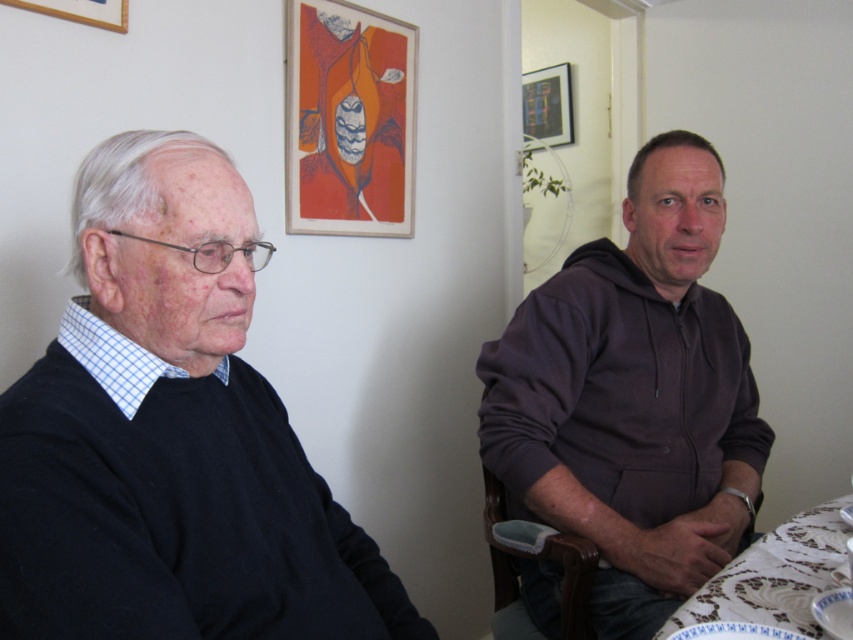
You are a delivery person trying to place a small package on the table near the white lace tablecloth at lower right. The package needs to be placed exactly 1.2 meters away from the wooden picture frame at upper left. Can you place it on that table?

The white lace tablecloth at lower right is 1.35 meters from the wooden picture frame at upper left. Since the required distance is 1.2 meters, placing the package on the table with the white lace tablecloth at lower right would be slightly farther than needed. You might need to find another location closer to the wooden picture frame at upper left.

You are a painter who needs to hang a new painting that is 3 feet wide. You are standing in the room and see the white lace tablecloth at lower right and the wooden picture frame at upper center. Can you fit the new painting between them without moving any existing items?

The distance between the white lace tablecloth at lower right and the wooden picture frame at upper center is 7.15 feet. Since the new painting is only 3 feet wide, it can fit between them as there is sufficient space.